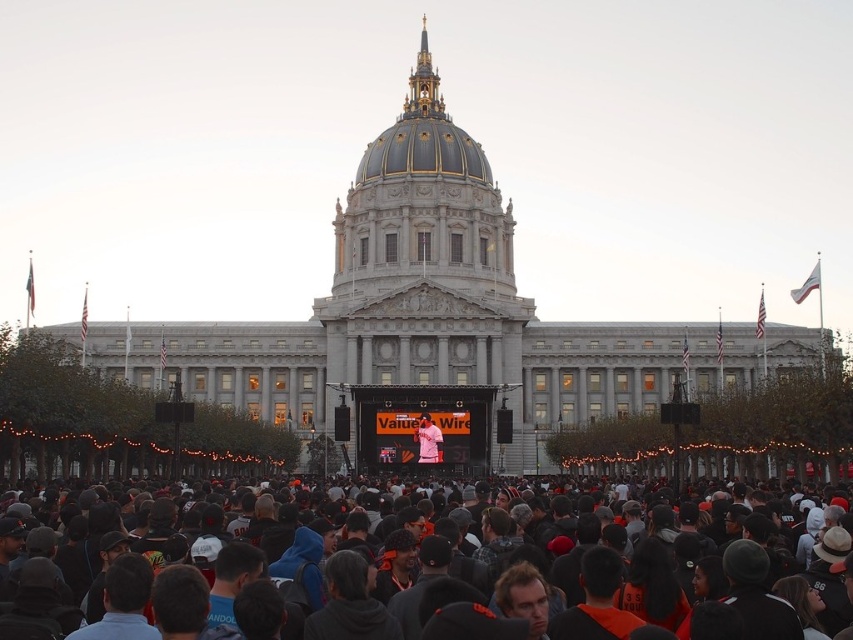
You are standing at the entrance of the grand neoclassical building with a dome and columns. You need to reach the stage in the middle ground. Is the black fabric crowd at center blocking your direct path to the stage?

The black fabric crowd at center is located at point (831, 589), which is near the bottom right corner of the image. Since the stage is in the middle ground, the crowd is not directly in front of the stage and therefore does not block the path.